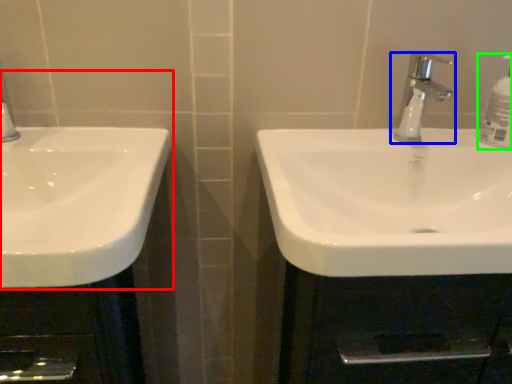
Question: Estimate the real-world distances between objects in this image. Which object is farther from sink (highlighted by a red box), tap (highlighted by a blue box) or soap dispenser (highlighted by a green box)?

Choices:
 (A) tap
 (B) soap dispenser

Answer: (B)